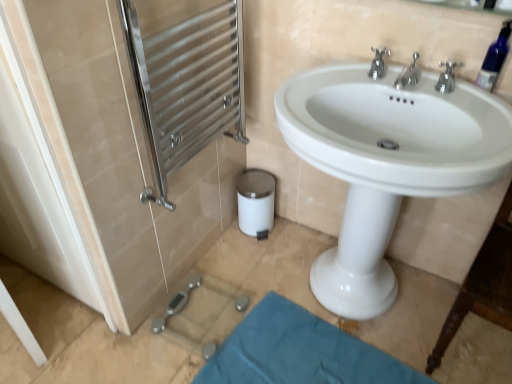
Where is `free spot to the left of polished chrome faucet at upper center, the third tap when ordered from right to left`? free spot to the left of polished chrome faucet at upper center, the third tap when ordered from right to left is located at coordinates (337, 84).